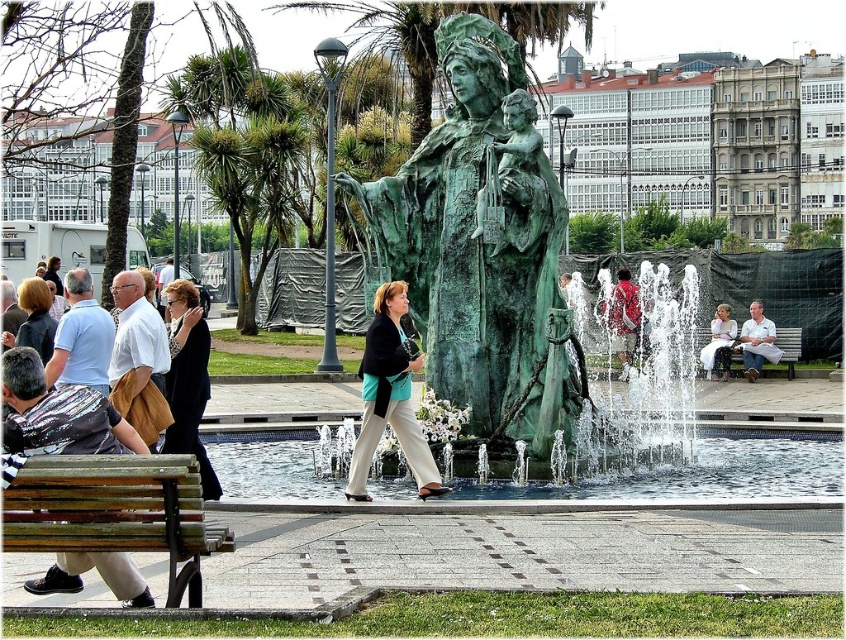
Which is behind, point (464, 298) or point (365, 474)?

Positioned behind is point (464, 298).

Which is above, green patina statue at center or matte black jacket at center?

→ green patina statue at center is higher up.

Is point (529, 161) more distant than point (354, 492)?

Yes, point (529, 161) is farther from viewer.

I want to click on green patina statue at center, so click(x=482, y=248).

Who is more distant from viewer, [179,536] or [630,365]?

Positioned behind is point [630,365].

Identify the location of wooden bench at lower left. (114, 512).

The width and height of the screenshot is (846, 640). I want to click on wooden bench at lower left, so click(114, 512).

Is point (102, 460) closer to viewer compared to point (37, 307)?

Yes, it is.

Which is below, wooden bench at lower left or matte black jacket at left?

wooden bench at lower left is lower down.

Between point (173, 528) and point (44, 296), which one is positioned in front?

Positioned in front is point (173, 528).

You are a GUI agent. You are given a task and a screenshot of the screen. Output one action in this format:
    pyautogui.click(x=<x>, y=<y>)
    Task: Click on the wooden bench at lower left
    This screenshot has height=640, width=846.
    Given the screenshot: What is the action you would take?
    pyautogui.click(x=114, y=512)